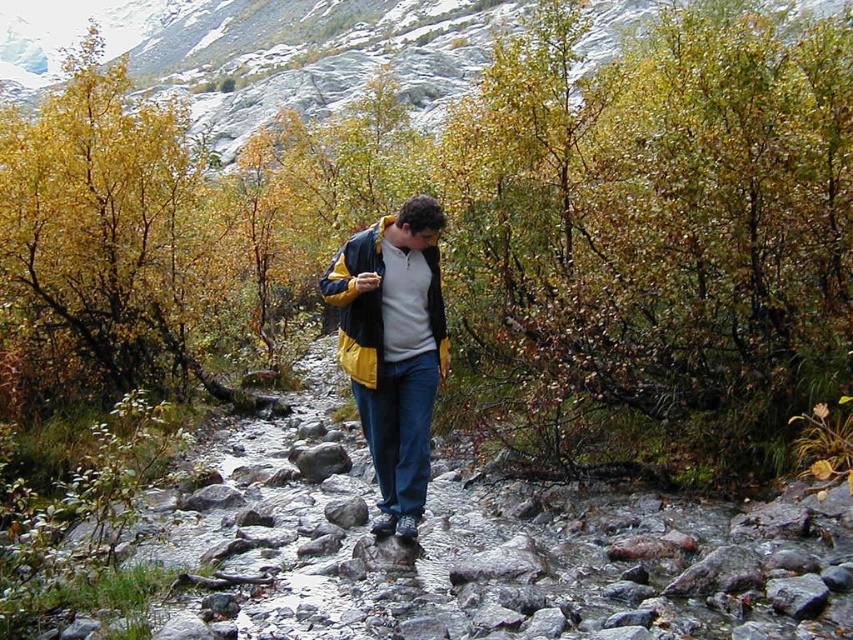
This screenshot has height=640, width=853. Find the location of `rocky gray mountain at upper center`. rocky gray mountain at upper center is located at coordinates (302, 54).

Where is `rocky gray mountain at upper center`? The height and width of the screenshot is (640, 853). rocky gray mountain at upper center is located at coordinates (302, 54).